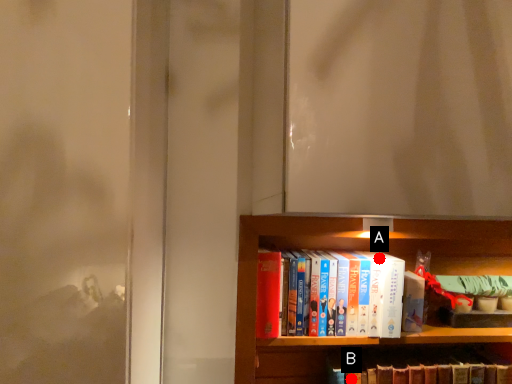
Question: Two points are circled on the image, labeled by A and B beside each circle. Which point is closer to the camera?

Choices:
 (A) A is closer
 (B) B is closer

Answer: (B)